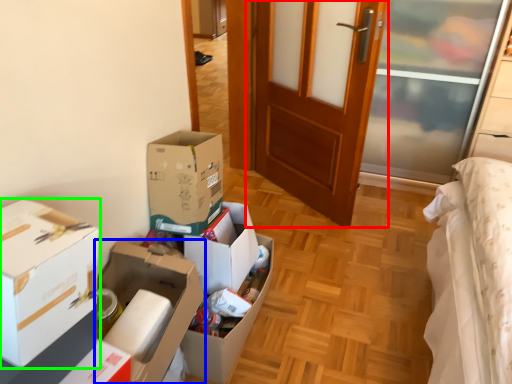
Question: Which object is the closest to the door (highlighted by a red box)? Choose among these: box (highlighted by a blue box) or box (highlighted by a green box).

Choices:
 (A) box
 (B) box

Answer: (A)